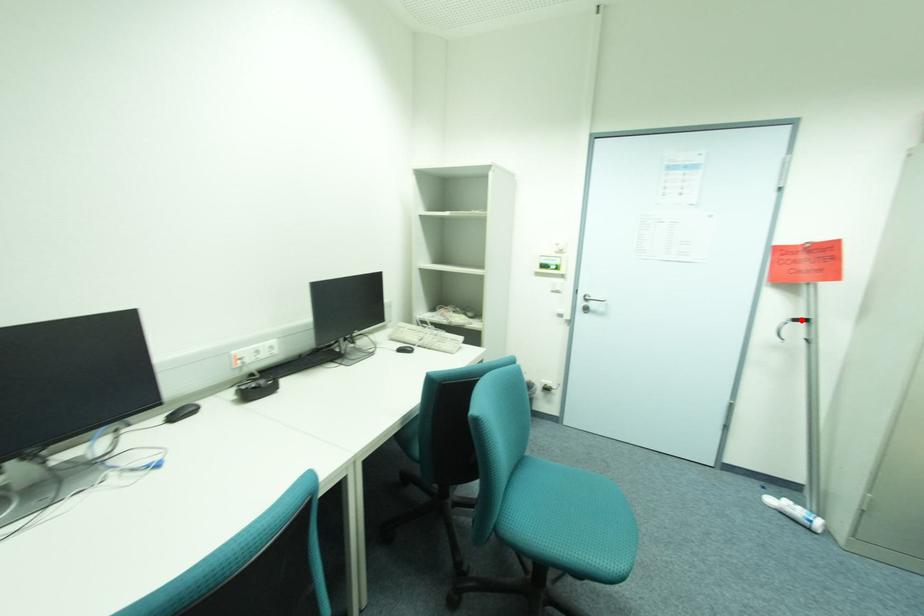
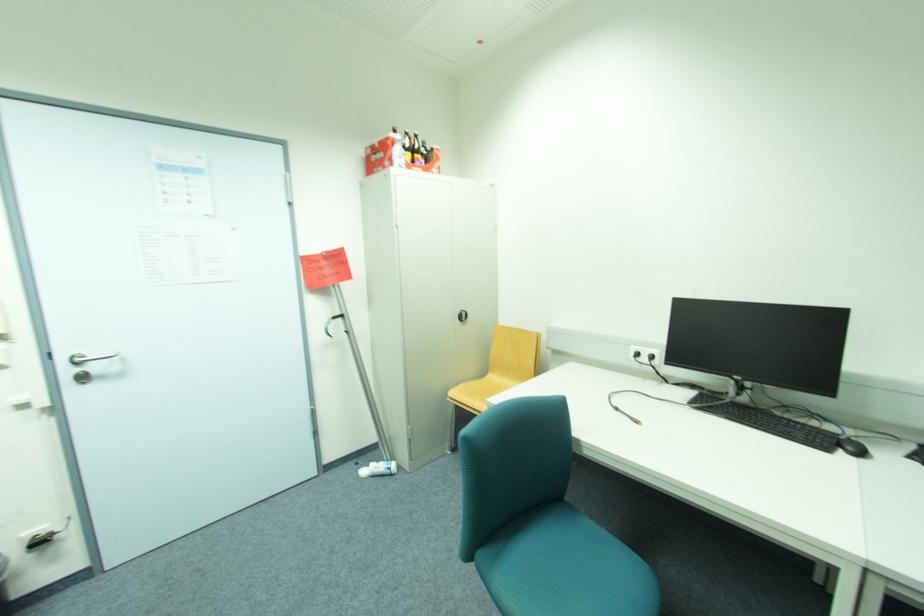
Locate, in the second image, the point that corresponds to the highlighted location in the first image.

(339, 317)